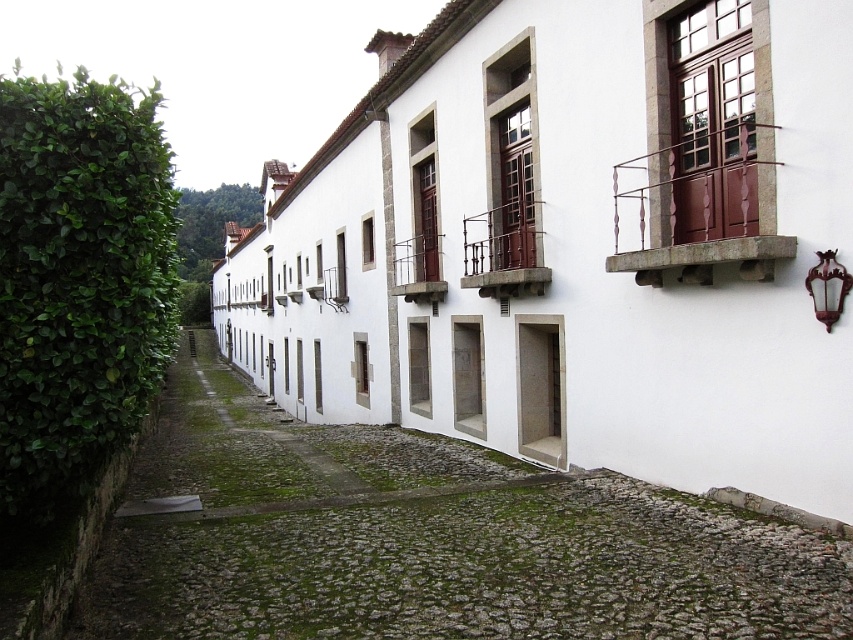
You are standing in front of the white building and want to walk to the green leafy hedge at left. In which direction should you move relative to the building?

The green leafy hedge at left is located at the left side of the building, so you should move to your left to reach it.

You are standing in front of the building and want to place a large potted plant on the balcony that is higher up. Which balcony should you choose between the wrought iron balcony at upper right and the brown wooden balcony at center?

The wrought iron balcony at upper right is positioned under the brown wooden balcony at center, so the brown wooden balcony at center is higher up. Therefore, you should choose the brown wooden balcony at center to place the large potted plant.

You are standing in front of the white building and want to know which object is taller between the green leafy hedge at left and the rustic wood balcony at center. Can you determine which one is taller?

The green leafy hedge at left is taller than the rustic wood balcony at center.